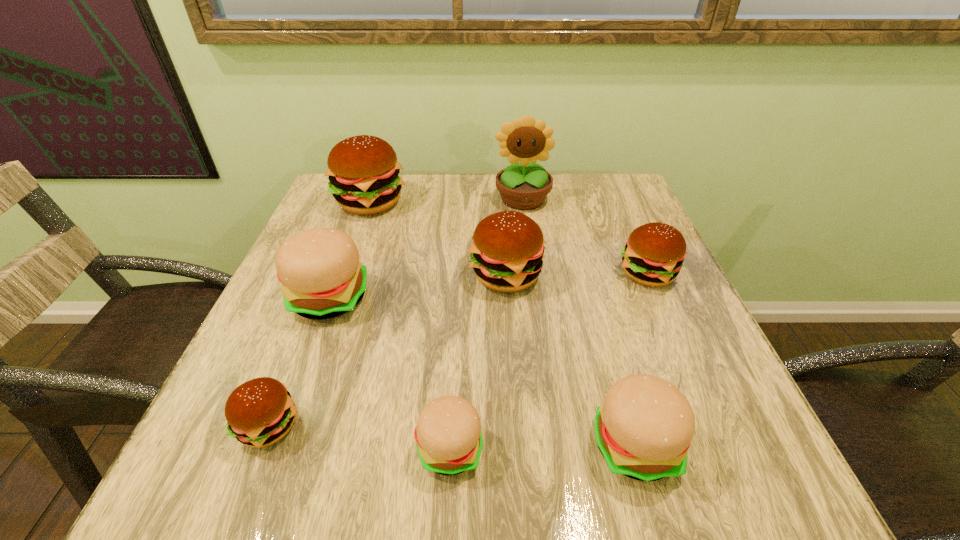
Image resolution: width=960 pixels, height=540 pixels. In order to click on free space located on the left of the smallest beige hamburger in this screenshot , I will do `click(276, 449)`.

The image size is (960, 540). I want to click on sunflower at the far edge, so click(x=522, y=186).

What are the coordinates of `hamburger located at the far edge` in the screenshot? It's located at [363, 170].

Where is `object located in the far left corner section of the desktop`? The image size is (960, 540). object located in the far left corner section of the desktop is located at coordinates (363, 170).

Where is `object situated at the near left corner`? The image size is (960, 540). object situated at the near left corner is located at coordinates (260, 412).

Locate an element on the screen. Image resolution: width=960 pixels, height=540 pixels. object located in the near right corner section of the desktop is located at coordinates (643, 429).

This screenshot has height=540, width=960. In order to click on free space at the far edge of the desktop in this screenshot , I will do `click(474, 181)`.

Identify the location of free location at the near edge of the desktop. The width and height of the screenshot is (960, 540). (574, 457).

This screenshot has width=960, height=540. In the image, there is a desktop. What are the coordinates of `vacant region at the left edge` in the screenshot? It's located at (350, 234).

Locate an element on the screen. The height and width of the screenshot is (540, 960). vacant space at the right edge of the desktop is located at coordinates (705, 385).